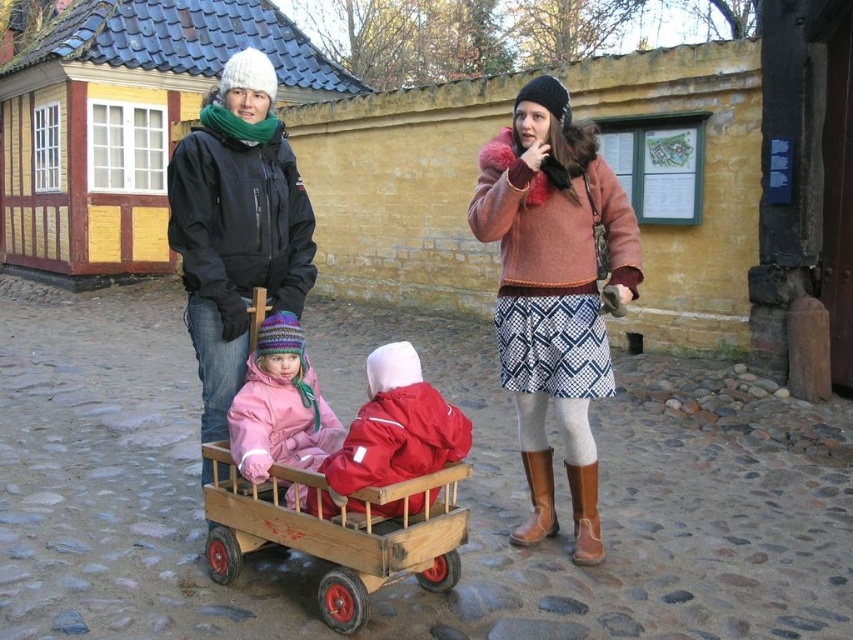
You are a photographer trying to capture the children in the wagon. Which child, the one in the red matte jacket at center or the matte pink snowsuit at center, is positioned closer to the front of the wagon?

The red matte jacket at center is closer to the viewer than the matte pink snowsuit at center, so the child in the red matte jacket at center is positioned closer to the front of the wagon.

You are standing in the historical area and see the wooden wagon at center and the red matte jacket at center. Which object is positioned lower in the scene?

The wooden wagon at center is located below the red matte jacket at center, so it is positioned lower in the scene.

You are a delivery robot with a package that needs to be placed between the wooden wagon at center and the matte pink snowsuit at center. The package is 13 inches long. Will it fit in the space between them?

The wooden wagon at center and matte pink snowsuit at center are 12.90 inches apart from each other. Since the package is 13 inches long, it will not fit in the space between them as the distance is slightly less than the package length.